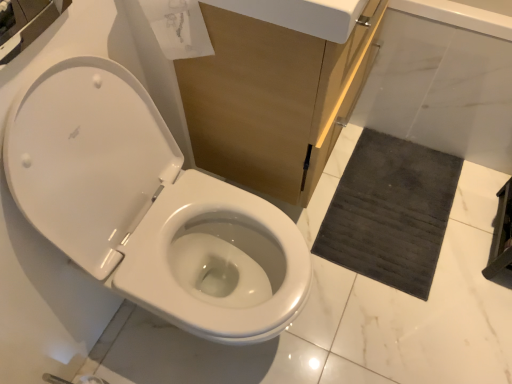
Question: From a real-world perspective, is white marble bath at lower right located beneath dark gray textured bath mat at lower right?

Choices:
 (A) yes
 (B) no

Answer: (B)

Question: Is white marble bath at lower right taller than dark gray textured bath mat at lower right?

Choices:
 (A) no
 (B) yes

Answer: (B)

Question: Would you say dark gray textured bath mat at lower right is part of white marble bath at lower right's contents?

Choices:
 (A) yes
 (B) no

Answer: (B)

Question: Can you confirm if white marble bath at lower right is shorter than dark gray textured bath mat at lower right?

Choices:
 (A) no
 (B) yes

Answer: (A)

Question: Does white marble bath at lower right appear on the left side of dark gray textured bath mat at lower right?

Choices:
 (A) yes
 (B) no

Answer: (B)

Question: Is white marble bath at lower right positioned with its back to dark gray textured bath mat at lower right?

Choices:
 (A) yes
 (B) no

Answer: (B)

Question: Does white glossy toilet at left lie behind dark gray textured bath mat at lower right?

Choices:
 (A) yes
 (B) no

Answer: (B)

Question: Would you say white glossy toilet at left is outside dark gray textured bath mat at lower right?

Choices:
 (A) no
 (B) yes

Answer: (B)

Question: From a real-world perspective, is white glossy toilet at left positioned over dark gray textured bath mat at lower right based on gravity?

Choices:
 (A) no
 (B) yes

Answer: (B)

Question: Is white glossy toilet at left taller than dark gray textured bath mat at lower right?

Choices:
 (A) yes
 (B) no

Answer: (A)

Question: From the image's perspective, is white glossy toilet at left below dark gray textured bath mat at lower right?

Choices:
 (A) yes
 (B) no

Answer: (A)

Question: Is white glossy toilet at left shorter than dark gray textured bath mat at lower right?

Choices:
 (A) no
 (B) yes

Answer: (A)

Question: Is white marble bath at lower right at the right side of transparent paper at upper center?

Choices:
 (A) yes
 (B) no

Answer: (A)